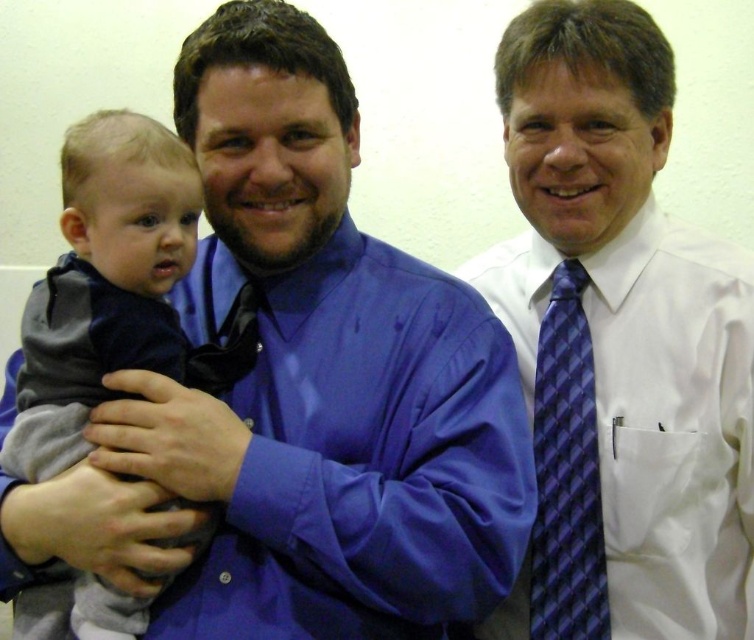
Which is behind, point (109, 200) or point (558, 524)?

Positioned behind is point (558, 524).

Does gray fleece baby at left lie in front of blue checkered tie at right?

Yes, it is in front of blue checkered tie at right.

Is point (32, 593) positioned after point (553, 483)?

No, it is not.

Identify the location of gray fleece baby at left. (103, 284).

Is point (590, 192) farther from camera compared to point (590, 593)?

No, it is in front of (590, 593).

Is white smooth shirt at center further to the viewer compared to blue checkered tie at right?

No, it is not.

Does point (615, 216) lie in front of point (541, 502)?

Yes, point (615, 216) is in front of point (541, 502).

I want to click on white smooth shirt at center, so click(x=618, y=346).

Which is more to the right, blue satin shirt at center or white smooth shirt at center?

From the viewer's perspective, white smooth shirt at center appears more on the right side.

Where is `blue satin shirt at center`? blue satin shirt at center is located at coordinates (299, 390).

The height and width of the screenshot is (640, 754). I want to click on blue satin shirt at center, so (x=299, y=390).